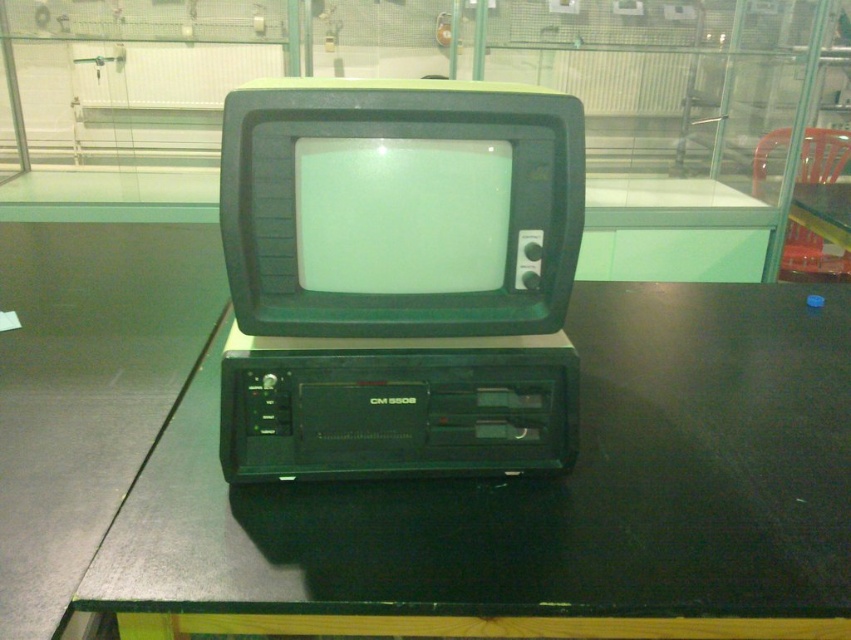
Is black glossy table at center thinner than green matte crt monitor at center?

In fact, black glossy table at center might be wider than green matte crt monitor at center.

Is black glossy table at center behind green matte crt monitor at center?

That is False.

Describe the element at coordinates (541, 499) in the screenshot. I see `black glossy table at center` at that location.

Identify the location of black glossy table at center. The width and height of the screenshot is (851, 640). (541, 499).